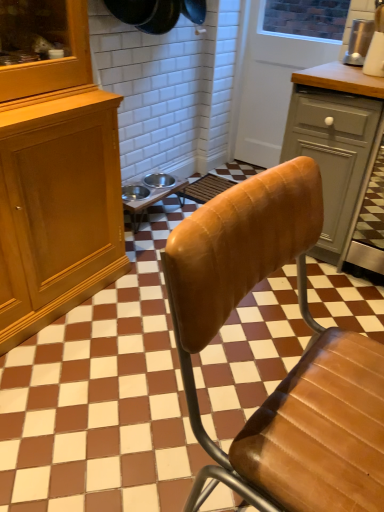
Question: From the image's perspective, is white wood screen door at upper center located above or below metallic silver appliance at upper right?

Choices:
 (A) below
 (B) above

Answer: (B)

Question: Is point (322, 4) positioned closer to the camera than point (347, 55)?

Choices:
 (A) farther
 (B) closer

Answer: (A)

Question: Which object is the farthest from the matte gray cabinet at right?

Choices:
 (A) metallic silver bowls at center
 (B) white wood screen door at upper center
 (C) metallic silver appliance at upper right
 (D) leather chair at center

Answer: (D)

Question: Which object is positioned farthest from the metallic silver bowls at center?

Choices:
 (A) matte gray cabinet at right
 (B) white wood screen door at upper center
 (C) leather chair at center
 (D) metallic silver appliance at upper right

Answer: (C)